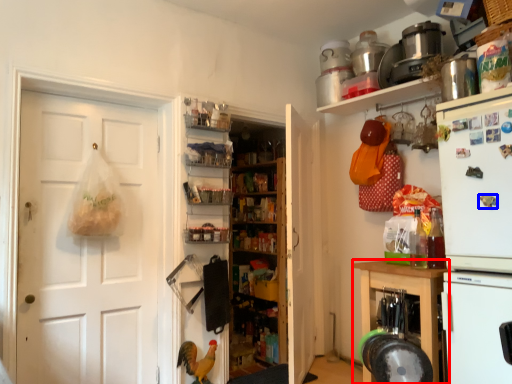
Question: Which object appears farthest to the camera in this image, cabinetry (highlighted by a red box) or magnet (highlighted by a blue box)?

Choices:
 (A) cabinetry
 (B) magnet

Answer: (A)